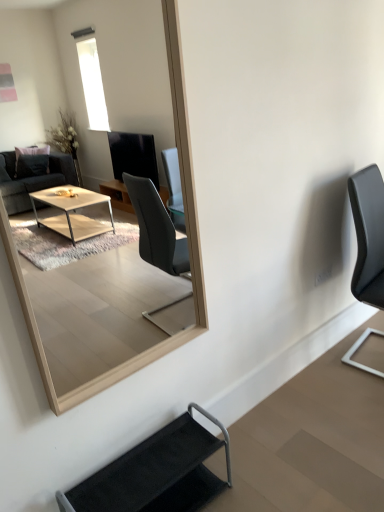
Where is `vacant space to the left of black leather chair at right, which is the 2th chair in bottom-to-top order`? vacant space to the left of black leather chair at right, which is the 2th chair in bottom-to-top order is located at coordinates (326, 373).